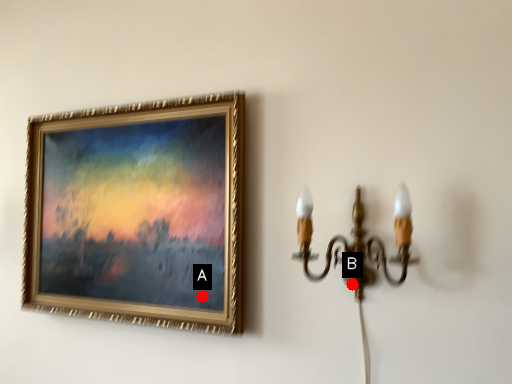
Question: Two points are circled on the image, labeled by A and B beside each circle. Which of the following is the closest to the observer?

Choices:
 (A) A is closer
 (B) B is closer

Answer: (B)